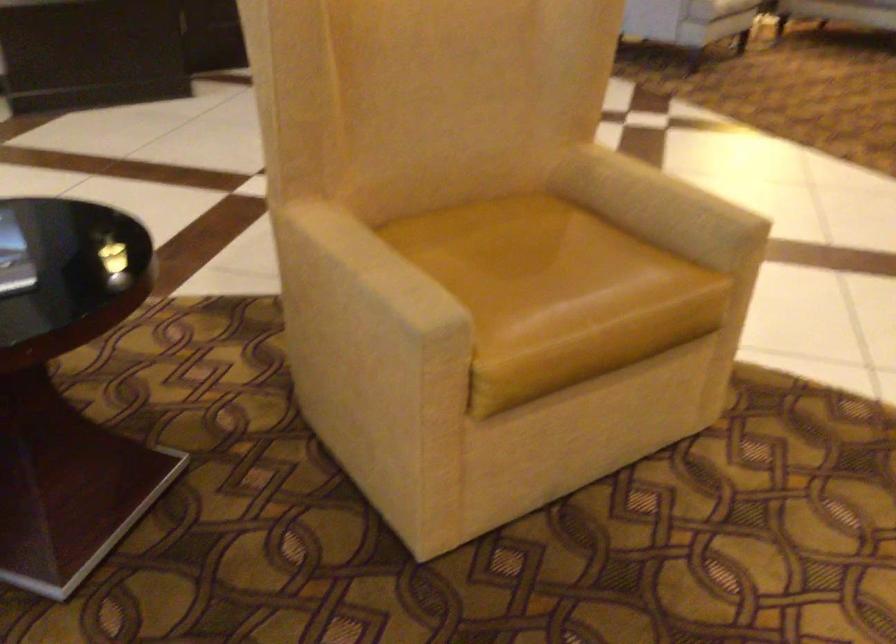
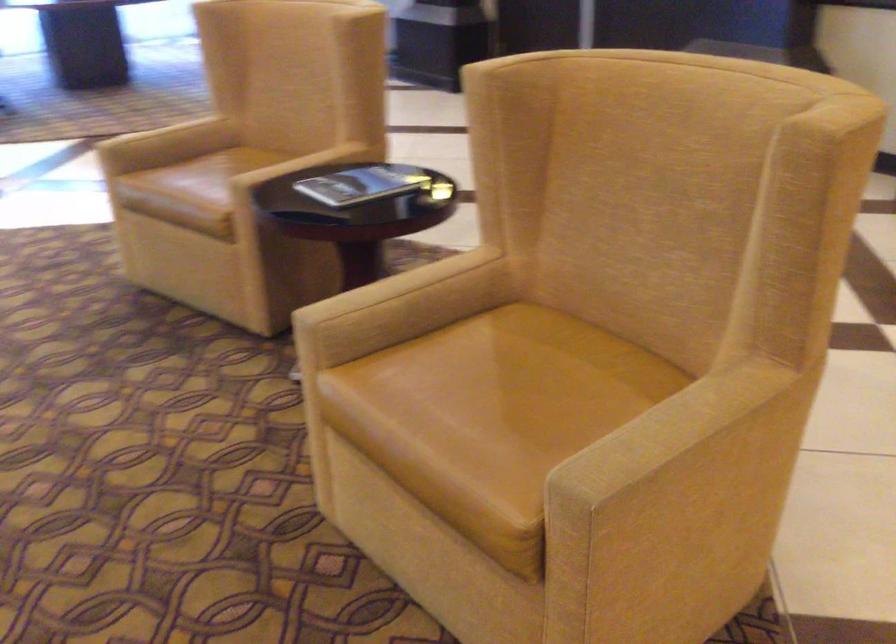
In the second image, find the point that corresponds to point (668, 185) in the first image.

(707, 433)